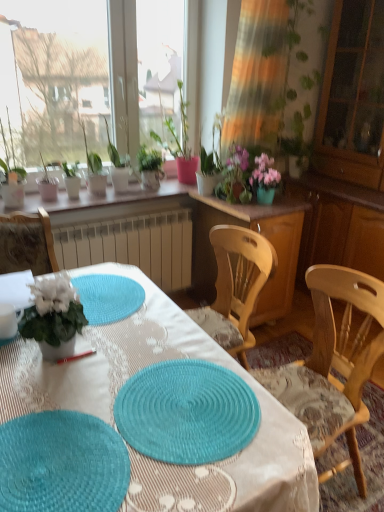
The height and width of the screenshot is (512, 384). Identify the location of free space to the left of teal woven placemat at center, the 2th mat positioned from the left. (68, 416).